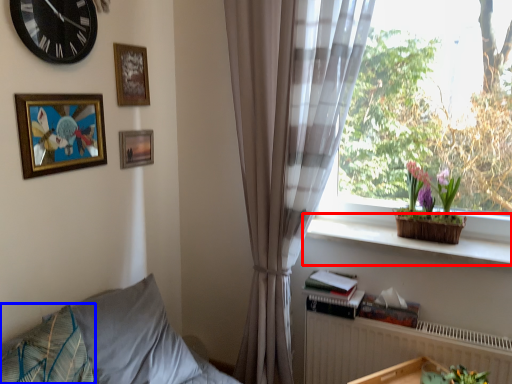
Question: Which object is further to the camera taking this photo, window sill (highlighted by a red box) or pillow (highlighted by a blue box)?

Choices:
 (A) window sill
 (B) pillow

Answer: (A)